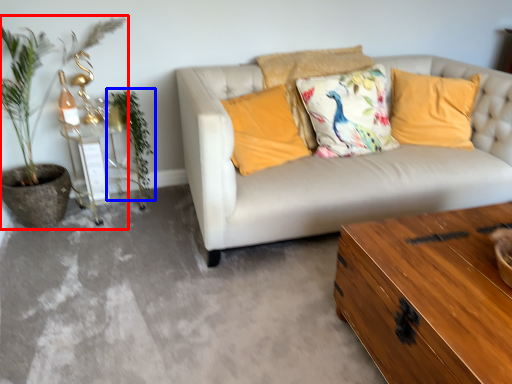
Question: Among these objects, which one is nearest to the camera, houseplant (highlighted by a red box) or plant (highlighted by a blue box)?

Choices:
 (A) houseplant
 (B) plant

Answer: (A)